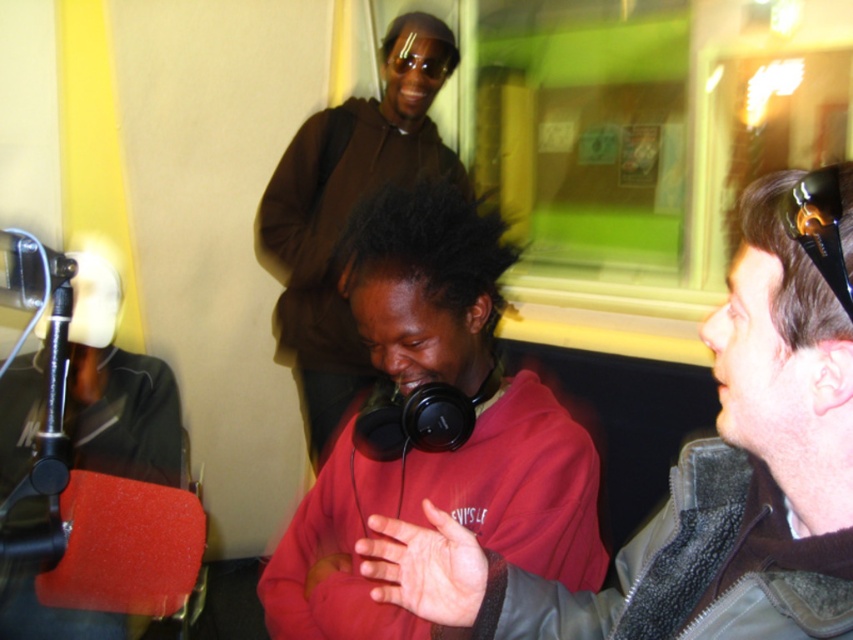
You are a photographer setting up for a group photo in the studio. You want to ensure everyone is in focus. The camera you are using has a depth of field that can sharply capture subjects within 25 inches from the camera. Is the point at coordinates point (373,552) within the camera focus range?

The point at coordinates point (373,552) is 31.23 inches from the camera, which is beyond the 25 inches depth of field range. Therefore, it will not be in focus.

You are setting up a camera in the studio and need to frame both the matte black headphones at center and the brown matte jacket at upper center in the shot. Which object should you adjust the camera angle to focus on first to ensure both are in frame?

The matte black headphones at center is shorter than the brown matte jacket at upper center, so you should adjust the camera angle to focus on the brown matte jacket at upper center first to ensure both are in frame.

You are a photographer positioned in front of the scene. You need to capture a photo where both the matte black headphones at center and the matte red hoodie at center are clearly visible. Given their heights, which object should you focus on first to ensure both are in frame?

The matte black headphones at center is shorter than the matte red hoodie at center. To ensure both are in frame, focus on the taller object first, which is the matte red hoodie at center, then adjust to include the shorter matte black headphones at center.